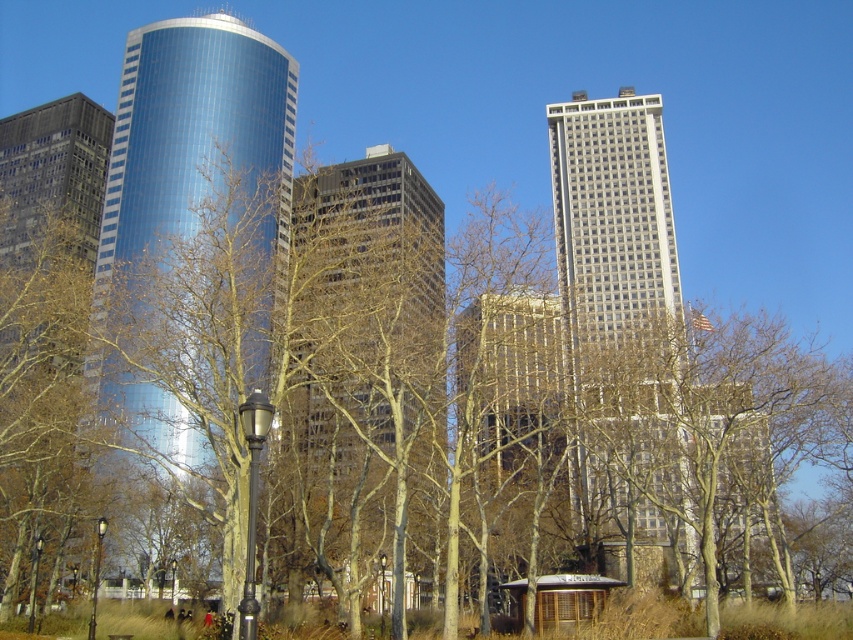
Question: Does brown glassy building at center have a greater width compared to glossy glass tower at center?

Choices:
 (A) no
 (B) yes

Answer: (A)

Question: Can you confirm if brown glassy building at center is thinner than glossy glass tower at center?

Choices:
 (A) yes
 (B) no

Answer: (A)

Question: Which object appears closest to the camera in this image?

Choices:
 (A) brown glassy building at center
 (B) glossy glass tower at center

Answer: (B)

Question: Which object is the farthest from the brown glassy building at center?

Choices:
 (A) gray glass skyscraper at center
 (B) glossy glass tower at center

Answer: (A)

Question: Is glossy glass tower at center positioned in front of gray glass skyscraper at center?

Choices:
 (A) yes
 (B) no

Answer: (A)

Question: Which point is closer to the camera?

Choices:
 (A) (569, 289)
 (B) (403, 332)
 (C) (97, 269)

Answer: (B)